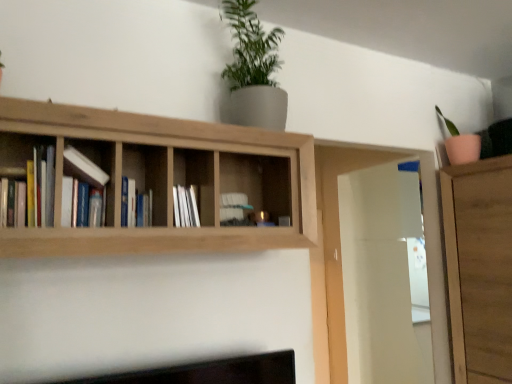
Question: Should I look upward or downward to see green matte plant at upper center?

Choices:
 (A) up
 (B) down

Answer: (A)

Question: Is there a large distance between white matte book at center-left, the 1th book positioned from the front, and light brown wood shelf at upper center?

Choices:
 (A) no
 (B) yes

Answer: (A)

Question: Is white matte book at center-left, the 1th book positioned from the front, not inside light brown wood shelf at upper center?

Choices:
 (A) no
 (B) yes

Answer: (A)

Question: Considering the relative positions of white matte book at center-left, the 1th book positioned from the front, and light brown wood shelf at upper center in the image provided, is white matte book at center-left, the 1th book positioned from the front, to the right of light brown wood shelf at upper center from the viewer's perspective?

Choices:
 (A) yes
 (B) no

Answer: (B)

Question: Can light brown wood shelf at upper center be found inside white matte book at center-left, the second book in the back-to-front sequence?

Choices:
 (A) no
 (B) yes

Answer: (A)

Question: Is white matte book at center-left, the second book in the back-to-front sequence, thinner than light brown wood shelf at upper center?

Choices:
 (A) yes
 (B) no

Answer: (A)

Question: From a real-world perspective, is white matte book at center-left, the 1th book positioned from the front, beneath light brown wood shelf at upper center?

Choices:
 (A) yes
 (B) no

Answer: (A)

Question: Is blue hardcover book at center, the 2th book when ordered from front to back, shorter than white matte book at center-left, the second book in the back-to-front sequence?

Choices:
 (A) yes
 (B) no

Answer: (A)

Question: Does blue hardcover book at center, the 2th book when ordered from front to back, have a smaller size compared to white matte book at center-left, the 1th book positioned from the front?

Choices:
 (A) no
 (B) yes

Answer: (B)

Question: Can you confirm if blue hardcover book at center, which is counted as the 1th book, starting from the back, is wider than white matte book at center-left, the second book in the back-to-front sequence?

Choices:
 (A) no
 (B) yes

Answer: (B)

Question: Can you confirm if blue hardcover book at center, which is counted as the 1th book, starting from the back, is bigger than white matte book at center-left, the second book in the back-to-front sequence?

Choices:
 (A) yes
 (B) no

Answer: (B)

Question: From a real-world perspective, does blue hardcover book at center, which is counted as the 1th book, starting from the back, stand above white matte book at center-left, the second book in the back-to-front sequence?

Choices:
 (A) no
 (B) yes

Answer: (A)

Question: Could you tell me if blue hardcover book at center, which is counted as the 1th book, starting from the back, is turned towards white matte book at center-left, the 1th book positioned from the front?

Choices:
 (A) no
 (B) yes

Answer: (A)

Question: Is blue hardcover book at center, which is counted as the 1th book, starting from the back, smaller than white glossy cabinet at center?

Choices:
 (A) yes
 (B) no

Answer: (A)